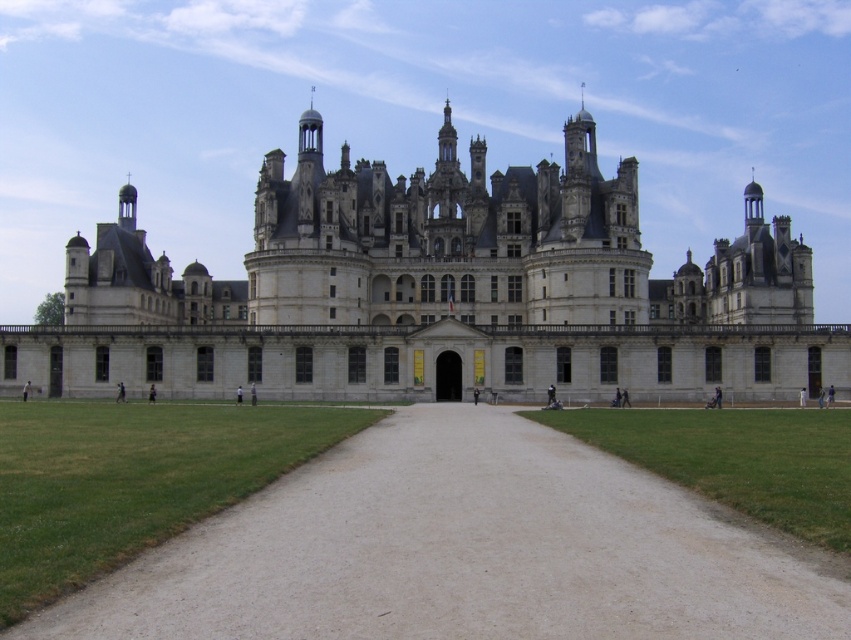
Is white stone castle at center positioned before dirt/gravel driveway at center?

No, white stone castle at center is further to the viewer.

Does white stone castle at center have a lesser height compared to dirt/gravel driveway at center?

No.

Between point (78, 269) and point (320, 566), which one is positioned in front?

Point (320, 566) is more forward.

The height and width of the screenshot is (640, 851). In order to click on white stone castle at center in this screenshot , I will do `click(437, 292)`.